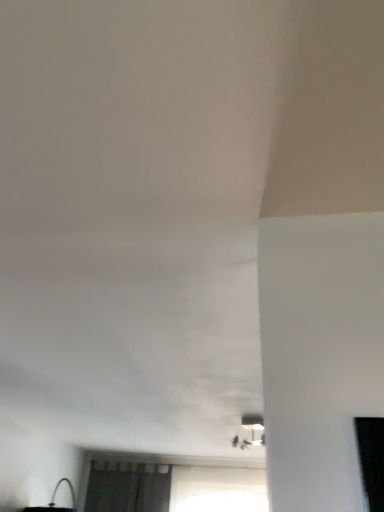
This screenshot has width=384, height=512. What do you see at coordinates (251, 430) in the screenshot?
I see `matte black lamp at center` at bounding box center [251, 430].

Identify the location of matte black lamp at center. Image resolution: width=384 pixels, height=512 pixels. (251, 430).

At what (x,y) coordinates should I click in order to perform the action: click on matte black lamp at center. Please return your answer as a coordinate pair (x, y). Looking at the image, I should click on (251, 430).